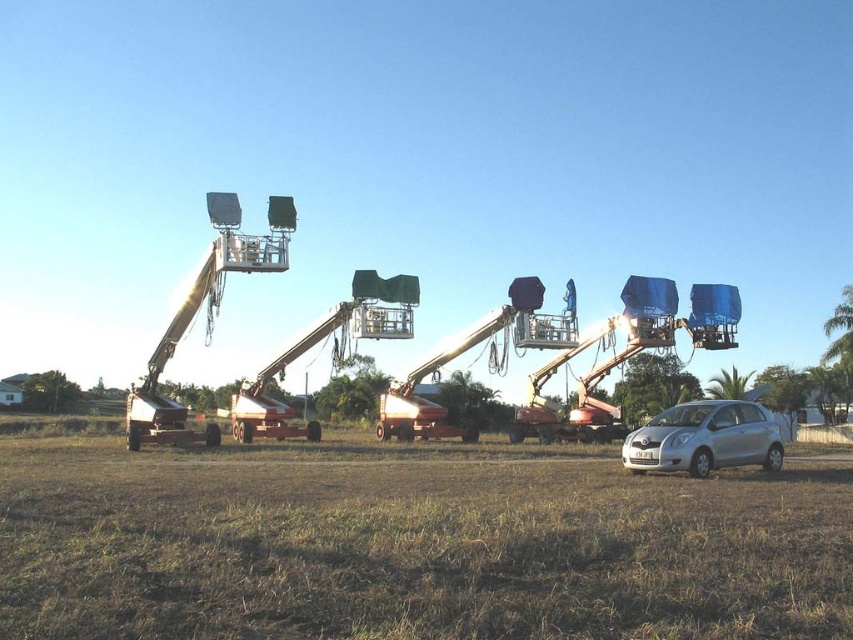
Which is more to the right, brown grass at lower center or silver metallic car at lower right?

silver metallic car at lower right is more to the right.

Does point (494, 496) come farther from viewer compared to point (763, 442)?

No, it is in front of (763, 442).

I want to click on brown grass at lower center, so click(413, 545).